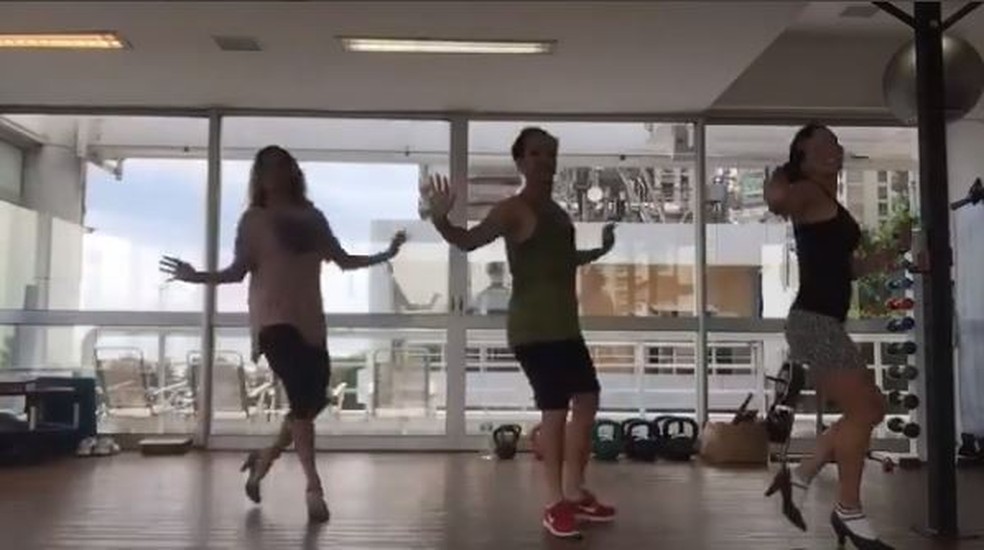
At what (x,y) coordinates should I click in order to perform the action: click on chair. Please return your answer as a coordinate pair (x, y). This screenshot has height=550, width=984. Looking at the image, I should click on (120, 387), (223, 389), (396, 382).